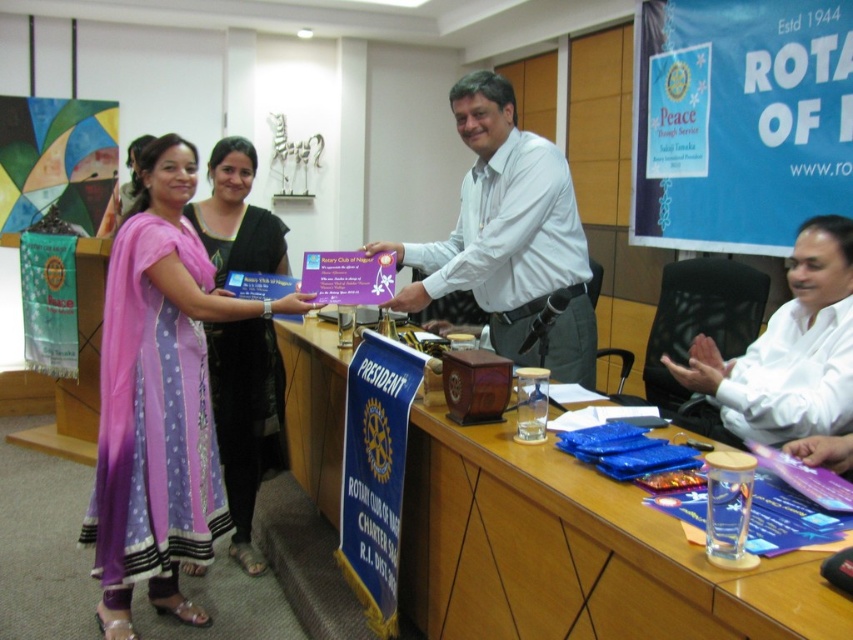
Question: Which of these objects is positioned farthest from the purple satin saree at left?

Choices:
 (A) white glossy shirt at right
 (B) wooden desk at center
 (C) purple satin kurta at left

Answer: (A)

Question: Can you confirm if wooden desk at center is smaller than purple satin saree at left?

Choices:
 (A) yes
 (B) no

Answer: (B)

Question: Can you confirm if wooden desk at center is positioned below purple satin kurta at left?

Choices:
 (A) yes
 (B) no

Answer: (A)

Question: Based on their relative distances, which object is farther from the white glossy shirt at center?

Choices:
 (A) white glossy shirt at right
 (B) wooden desk at center
 (C) purple satin kurta at left
 (D) purple satin saree at left

Answer: (D)

Question: From the image, what is the correct spatial relationship of wooden desk at center in relation to white glossy shirt at center?

Choices:
 (A) above
 (B) below

Answer: (B)

Question: Estimate the real-world distances between objects in this image. Which object is closer to the purple satin kurta at left?

Choices:
 (A) white glossy shirt at center
 (B) purple satin saree at left

Answer: (B)